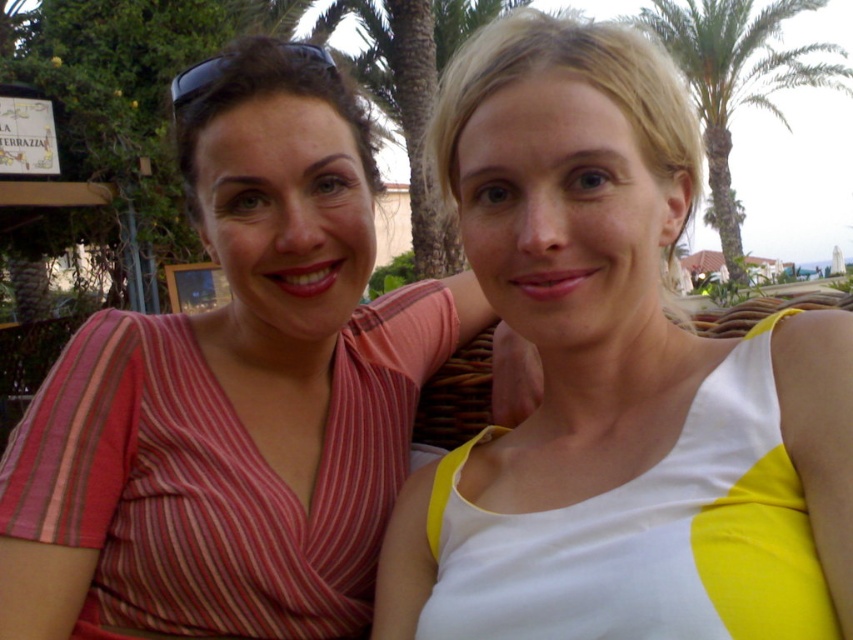
Question: Does white/yellow fabric dress at center appear on the left side of striped fabric dress at left?

Choices:
 (A) yes
 (B) no

Answer: (B)

Question: Considering the real-world distances, which object is farthest from the green leafy palm tree at upper right?

Choices:
 (A) white/yellow fabric dress at center
 (B) striped fabric dress at left

Answer: (A)

Question: Which point is farther to the camera?

Choices:
 (A) coord(695,337)
 (B) coord(108,444)

Answer: (B)

Question: Based on their relative distances, which object is farther from the green leafy palm tree at upper right?

Choices:
 (A) white/yellow fabric dress at center
 (B) striped fabric dress at left

Answer: (A)

Question: Does white/yellow fabric dress at center have a larger size compared to green leafy palm tree at upper right?

Choices:
 (A) yes
 (B) no

Answer: (A)

Question: Considering the relative positions of white/yellow fabric dress at center and green leafy palm tree at upper right in the image provided, where is white/yellow fabric dress at center located with respect to green leafy palm tree at upper right?

Choices:
 (A) above
 (B) below

Answer: (B)